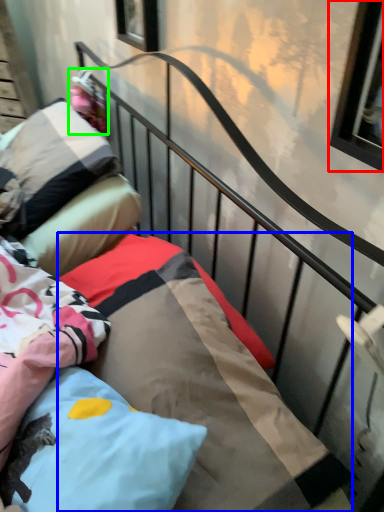
Question: Which object is positioned farthest from window (highlighted by a red box)? Select from mattress (highlighted by a blue box) and doll (highlighted by a green box).

Choices:
 (A) mattress
 (B) doll

Answer: (B)